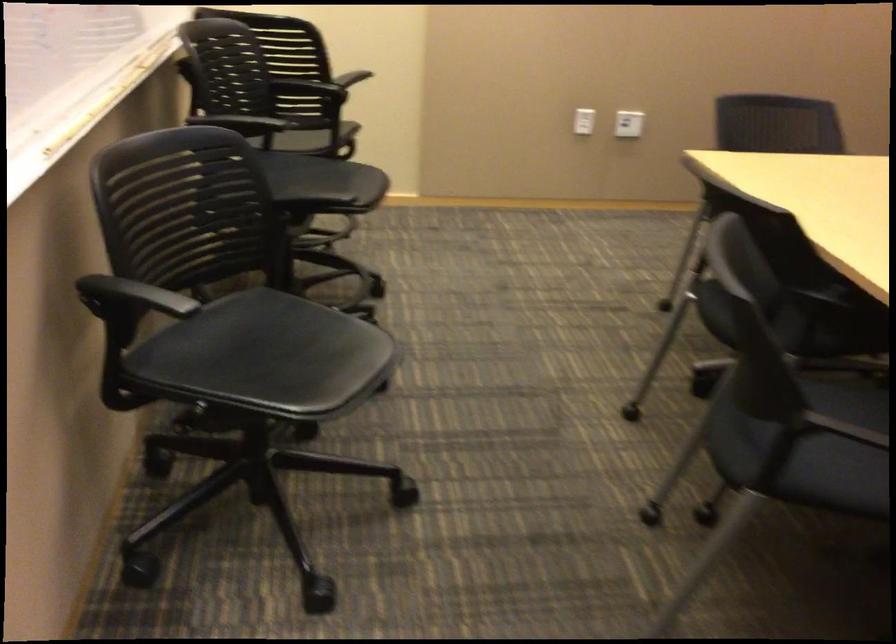
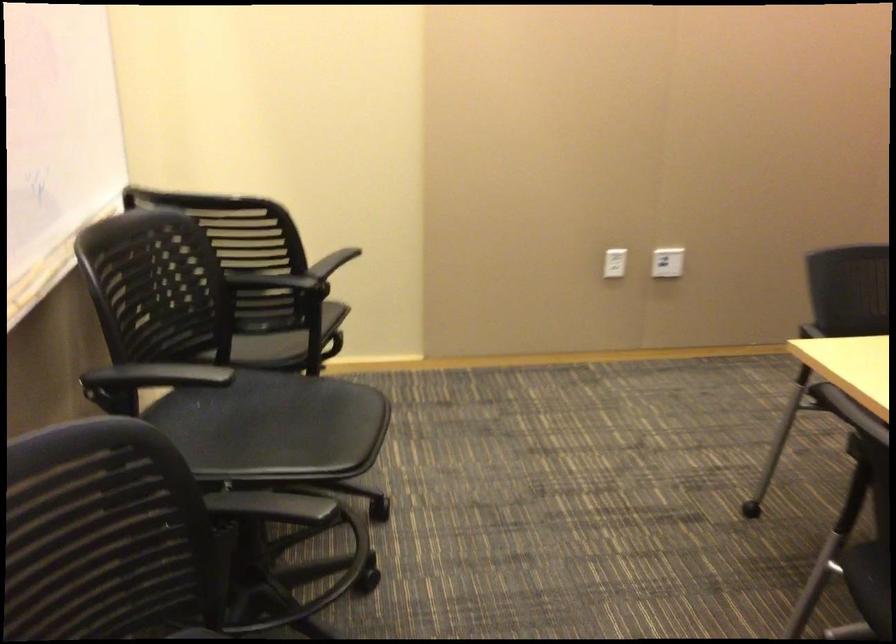
Question: Which direction would the cameraman need to move to produce the second image? Reply with the corresponding letter.

Choices:
 (A) Left
 (B) Right
 (C) Forward
 (D) Backward

Answer: (C)